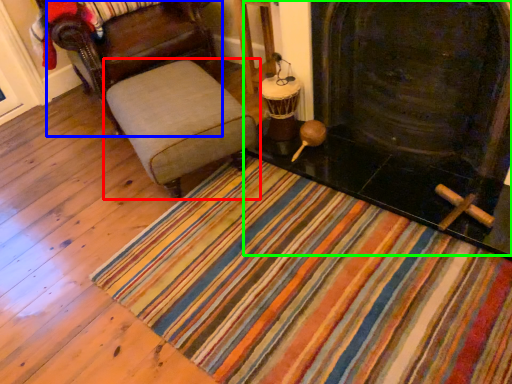
Question: Based on their relative distances, which object is nearer to furniture (highlighted by a red box)? Choose from chair (highlighted by a blue box) and fireplace (highlighted by a green box).

Choices:
 (A) chair
 (B) fireplace

Answer: (A)